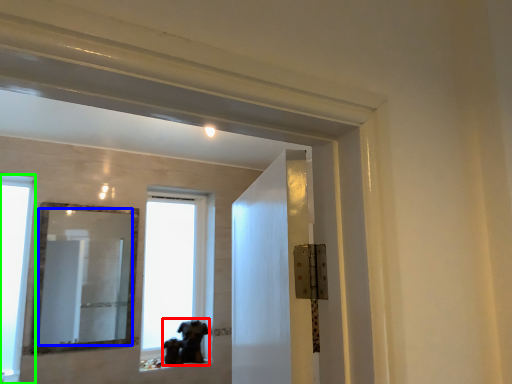
Question: Which object is the farthest from animal (highlighted by a red box)? Choose among these: mirror (highlighted by a blue box) or window (highlighted by a green box).

Choices:
 (A) mirror
 (B) window

Answer: (A)